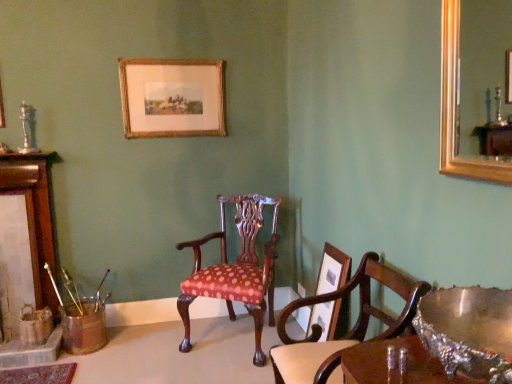
Question: Is the depth of wooden picture frame at center, arranged as the 1th picture frame when viewed from the right, less than that of gold-framed print at upper center, which appears as the 2th picture frame when viewed from the front?

Choices:
 (A) yes
 (B) no

Answer: (A)

Question: Is wooden picture frame at center, arranged as the 1th picture frame when viewed from the right, not near gold-framed print at upper center, the second picture frame viewed from the right?

Choices:
 (A) no
 (B) yes

Answer: (B)

Question: Can you confirm if wooden picture frame at center, which appears as the second picture frame when viewed from the back, is bigger than gold-framed print at upper center, which is counted as the 1th picture frame, starting from the top?

Choices:
 (A) no
 (B) yes

Answer: (A)

Question: Is wooden picture frame at center, the second picture frame in the top-to-bottom sequence, further to camera compared to gold-framed print at upper center, which is counted as the 1th picture frame, starting from the top?

Choices:
 (A) no
 (B) yes

Answer: (A)

Question: From the image's perspective, is wooden picture frame at center, arranged as the 1th picture frame when viewed from the right, on gold-framed print at upper center, which ranks as the 1th picture frame in back-to-front order?

Choices:
 (A) yes
 (B) no

Answer: (B)

Question: Is wooden picture frame at center, the first picture frame from the bottom, not within gold-framed print at upper center, which ranks as the 1th picture frame in back-to-front order?

Choices:
 (A) yes
 (B) no

Answer: (A)

Question: Considering the relative positions of polka dot fabric chair at center, the 2th chair from the front, and wooden picture frame at center, which appears as the second picture frame when viewed from the back, in the image provided, is polka dot fabric chair at center, the 2th chair from the front, to the left of wooden picture frame at center, which appears as the second picture frame when viewed from the back, from the viewer's perspective?

Choices:
 (A) yes
 (B) no

Answer: (A)

Question: Is polka dot fabric chair at center, which ranks as the 1th chair in back-to-front order, closer to camera compared to wooden picture frame at center, the first picture frame from the bottom?

Choices:
 (A) no
 (B) yes

Answer: (A)

Question: Can we say polka dot fabric chair at center, the 2th chair from the front, lies outside wooden picture frame at center, placed as the first picture frame when sorted from front to back?

Choices:
 (A) yes
 (B) no

Answer: (A)

Question: Is polka dot fabric chair at center, which ranks as the 1th chair in back-to-front order, beside wooden picture frame at center, arranged as the 1th picture frame when viewed from the right?

Choices:
 (A) yes
 (B) no

Answer: (B)

Question: Is polka dot fabric chair at center, which ranks as the 1th chair in back-to-front order, facing towards wooden picture frame at center, which appears as the second picture frame when viewed from the back?

Choices:
 (A) yes
 (B) no

Answer: (B)

Question: Considering the relative sizes of polka dot fabric chair at center, the 2th chair from the front, and wooden picture frame at center, arranged as the 1th picture frame when viewed from the right, in the image provided, is polka dot fabric chair at center, the 2th chair from the front, smaller than wooden picture frame at center, arranged as the 1th picture frame when viewed from the right,?

Choices:
 (A) yes
 (B) no

Answer: (B)

Question: Can you confirm if brushed metal fireplace at left is positioned to the right of polka dot fabric chair at center, which ranks as the 1th chair in back-to-front order?

Choices:
 (A) yes
 (B) no

Answer: (B)